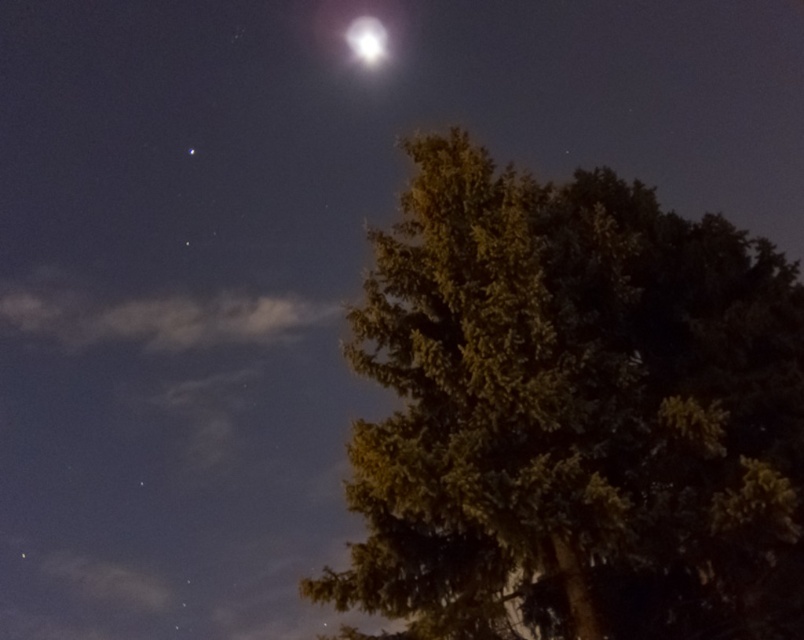
You are standing in the night scene and want to walk towards the green textured tree at right. Based on its position, which direction should you move relative to your current position?

The green textured tree at right is located at point 0.648 on the x axis and 0.714 on the y axis. Since the coordinate system is not specified, but generally in such systems, higher x means right and higher y means up. Assuming you are at the origin, you should move towards the right and upwards to reach the tree.

You are stargazing and notice the green textured tree at right and the bright white crystal at upper center. Which object is positioned higher in the sky?

The bright white crystal at upper center is positioned higher in the sky than the green textured tree at right.

You are an astronomer observing the night sky. You notice the green textured tree at right and the bright white crystal at upper center. Which object would appear larger in your telescope if you focus on them individually?

The green textured tree at right would appear larger in the telescope because it is bigger than the bright white crystal at upper center according to the description.